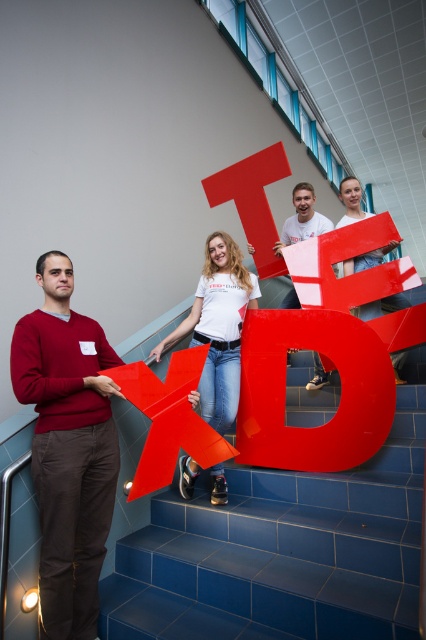
You are a photographer trying to capture the TED sign clearly. There is a person wearing a matte red sweater at left blocking part of the letter D. Can you move to the right side of the glossy plastic letter d at center to get a better shot?

The matte red sweater at left is to the left of the glossy plastic letter d at center, so moving to the right side of the glossy plastic letter d at center would position you away from the obstruction, allowing a clear view of the letter D.